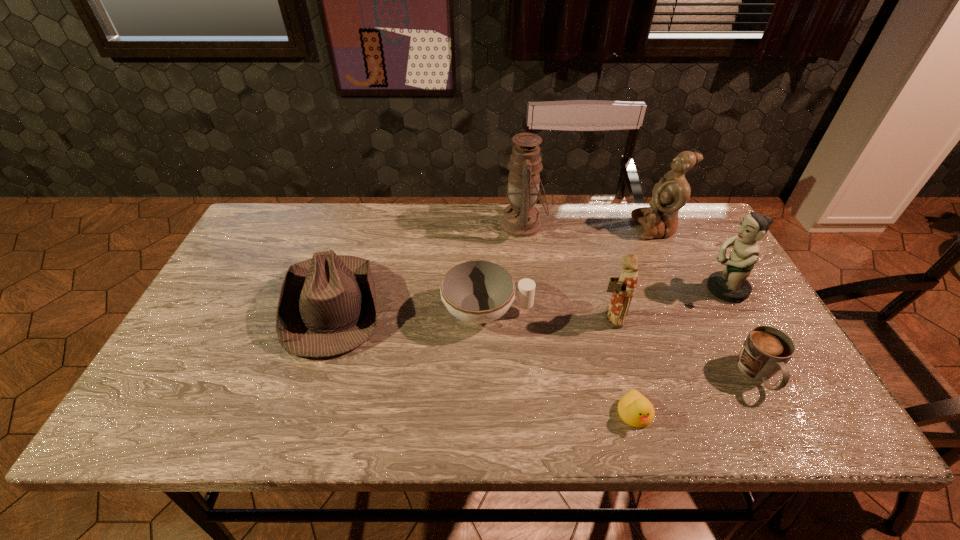
The width and height of the screenshot is (960, 540). I want to click on vacant space at the near edge, so click(x=328, y=429).

Image resolution: width=960 pixels, height=540 pixels. I want to click on free space at the left edge of the desktop, so (253, 290).

The width and height of the screenshot is (960, 540). Find the location of `blank space at the right edge of the desktop`. blank space at the right edge of the desktop is located at coordinates (706, 300).

Image resolution: width=960 pixels, height=540 pixels. I want to click on vacant area at the far left corner, so click(253, 244).

Where is `vacant space at the near left corner of the desktop`? vacant space at the near left corner of the desktop is located at coordinates (146, 433).

Identify the location of vacant space at the far right corner of the desktop. (705, 219).

I want to click on free spot between the duckling and the second nearest figurine, so click(x=680, y=352).

Where is `free area in between the leftmost object and the mug`? free area in between the leftmost object and the mug is located at coordinates (546, 340).

Find the location of a particular element. This screenshot has width=960, height=540. vacant point located between the oil lamp and the chinaware is located at coordinates (505, 268).

The height and width of the screenshot is (540, 960). I want to click on vacant area that lies between the shortest object and the mug, so click(x=696, y=394).